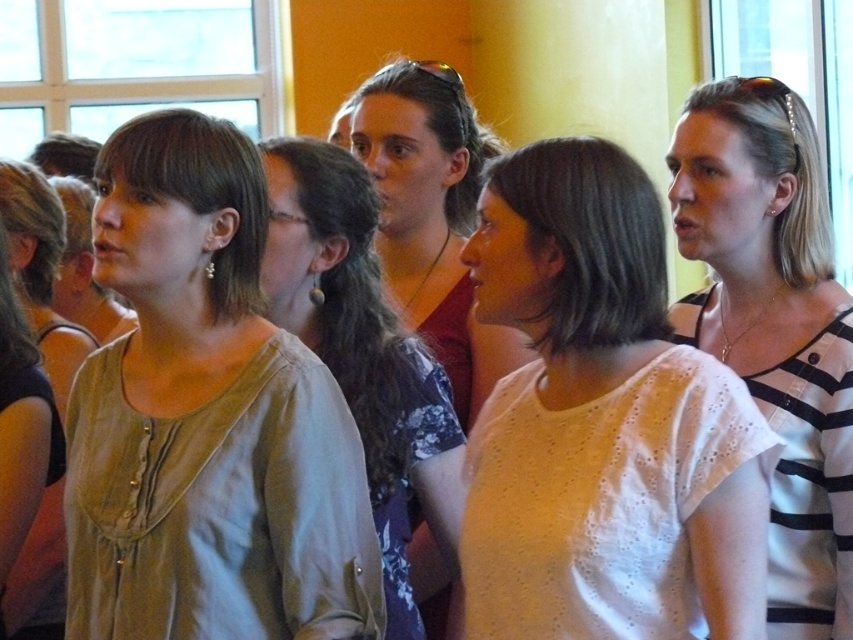
Question: Can you confirm if white cotton shirt at center is positioned below white striped shirt at right?

Choices:
 (A) yes
 (B) no

Answer: (A)

Question: Can you confirm if white cotton shirt at center is wider than matte brown hair at center?

Choices:
 (A) no
 (B) yes

Answer: (B)

Question: Does white striped shirt at right appear on the right side of light beige blouse at center?

Choices:
 (A) yes
 (B) no

Answer: (A)

Question: Among these objects, which one is farthest from the camera?

Choices:
 (A) matte beige blouse at center
 (B) white cotton shirt at center
 (C) matte brown hair at center

Answer: (C)

Question: Which of these objects is positioned closest to the matte beige blouse at center?

Choices:
 (A) light beige blouse at center
 (B) matte gray blouse at center

Answer: (B)

Question: Among these points, which one is nearest to the camera?

Choices:
 (A) (399, 422)
 (B) (351, 122)
 (C) (270, 497)
 (D) (653, 337)

Answer: (D)